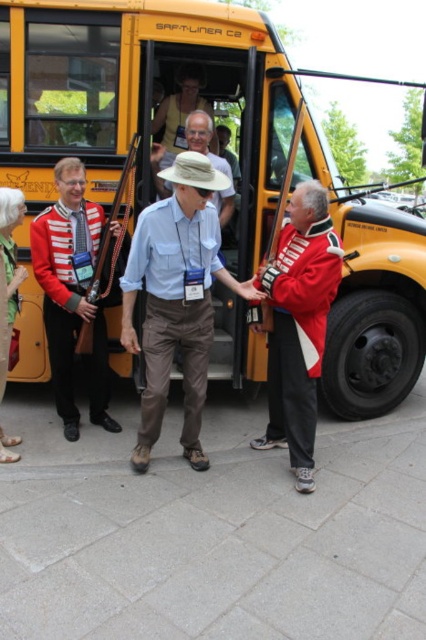
In the scene shown: You are a student standing at the edge of the school parking lot. You see a yellow matte school bus at center and a red and white striped uniform at center. Which object is closer to the left side of the parking lot?

The red and white striped uniform at center is closer to the left side of the parking lot because the yellow matte school bus at center is positioned on the right side of it.

You are a photographer trying to take a picture of the light blue cotton shirt at center and the red wool jacket at center. Which object should you focus on first if you want to capture both in the same frame without moving the camera?

The light blue cotton shirt at center is taller than the red wool jacket at center, so you should focus on the light blue cotton shirt at center first to ensure both are in the frame.

You are standing in front of the yellow Saf T Liner C2 bus and want to move from point A to point B. Which point is closer to you, point A at coordinates point (164, 51) or point B at coordinates point (155, 339)?

Point A at coordinates point (164, 51) is closer to you because it is further to the viewer than point B at coordinates point (155, 339).